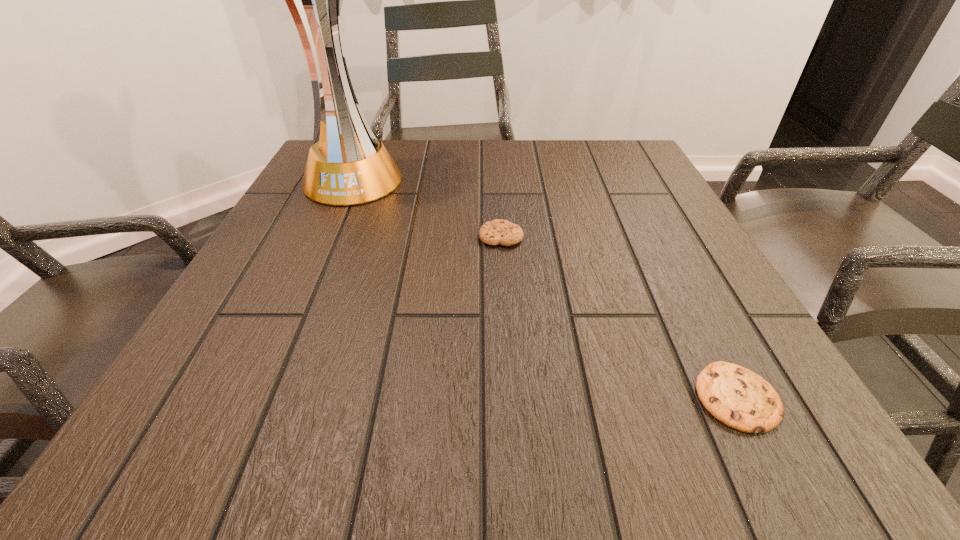
I want to click on the tallest object, so click(x=353, y=168).

At what (x,y) coordinates should I click in order to perform the action: click on the leftmost object. Please return your answer as a coordinate pair (x, y). Image resolution: width=960 pixels, height=540 pixels. Looking at the image, I should click on (353, 168).

The image size is (960, 540). Identify the location of the left cookie. (503, 232).

The width and height of the screenshot is (960, 540). What are the coordinates of `the farther cookie` in the screenshot? It's located at (503, 232).

You are a GUI agent. You are given a task and a screenshot of the screen. Output one action in this format:
    pyautogui.click(x=<x>, y=<y>)
    Task: Click on the shorter cookie
    This screenshot has height=540, width=960.
    Given the screenshot: What is the action you would take?
    pyautogui.click(x=734, y=395)

Locate an element on the screen. This screenshot has width=960, height=540. the nearer cookie is located at coordinates [734, 395].

Where is `free space located on the front-facing side of the leftmost object`? free space located on the front-facing side of the leftmost object is located at coordinates (315, 261).

Locate an element on the screen. The height and width of the screenshot is (540, 960). vacant space located on the left of the farther cookie is located at coordinates (329, 237).

Identify the location of blank space located on the back of the shortest object. The image size is (960, 540). (662, 252).

Identify the location of object located in the far edge section of the desktop. (353, 168).